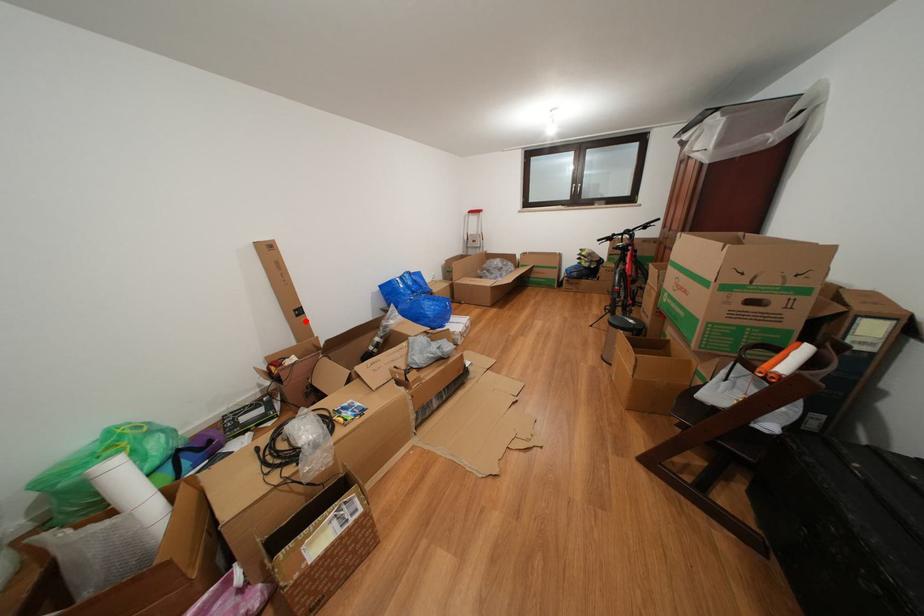
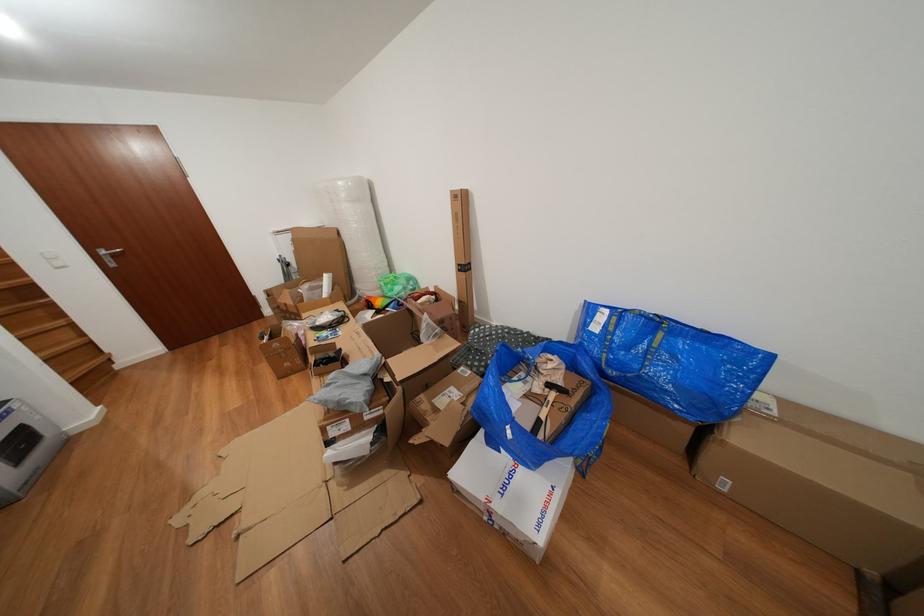
Find the pixel in the second image that matches the highlighted location in the first image.

(468, 276)